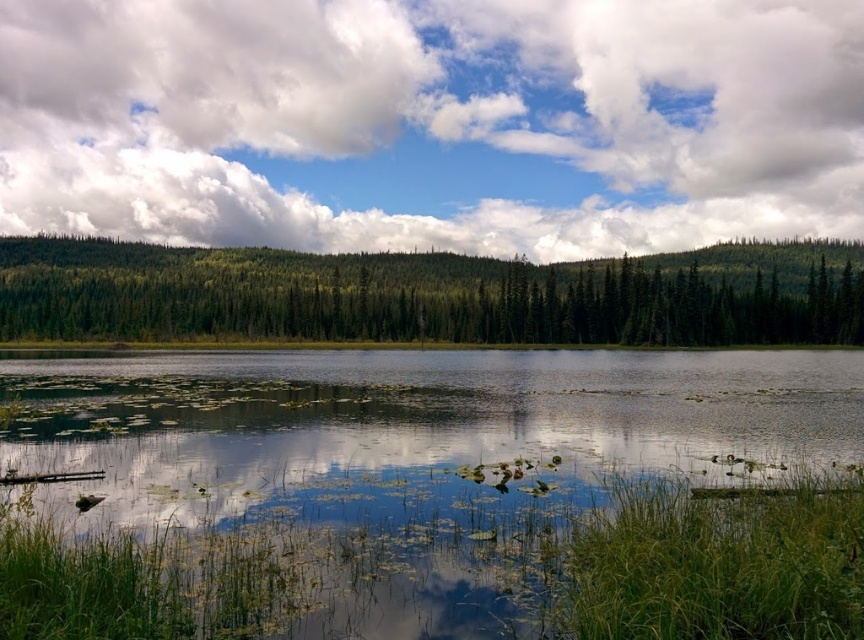
You are an artist trying to paint the scene. You want to ensure the white fluffy cloud at upper center and the transparent water at center are proportionally accurate. Which object should you paint larger?

The white fluffy cloud at upper center should be painted larger because it has a larger size compared to the transparent water at center according to the description.

You are a bird soaring high above the landscape. You see the white fluffy cloud at upper center and the green matte forest at center. Which object is positioned higher in the sky?

The white fluffy cloud at upper center is positioned higher in the sky than the green matte forest at center.

You are standing at the edge of the water and looking towards the forest. Which object is positioned to the right side when comparing the white fluffy cloud at upper center and the green matte forest at center?

The white fluffy cloud at upper center is positioned to the right of the green matte forest at center.